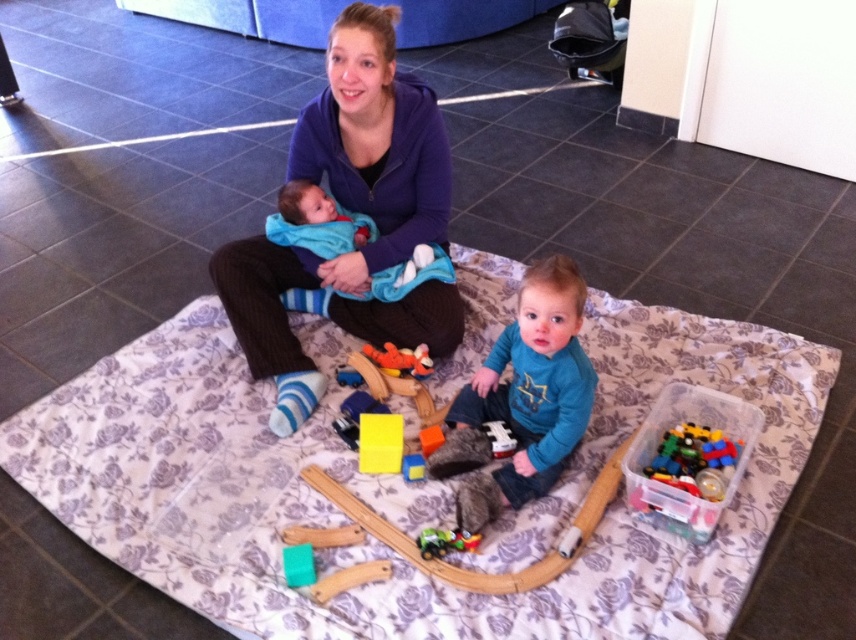
You are a photographer setting up a shot of the scene. You need to place a small prop exactly halfway between the two points marked as point [741,376] and point [358,362]. Will the prop be closer to the camera or further away compared to the average distance of the two points?

The prop placed halfway between point [741,376] and point [358,362] will be closer to the camera than the average distance because point [741,376] is closer to the camera than point [358,362].

Based on the photo, you are standing in the room and see the point at coordinates (468, 413). If you want to reach it without moving your feet, can you stretch your arm out to touch it?

The point at coordinates (468, 413) is 6.21 feet away from the viewer. Since the average human arm length is about 2.5 feet, you cannot reach it without moving your feet.